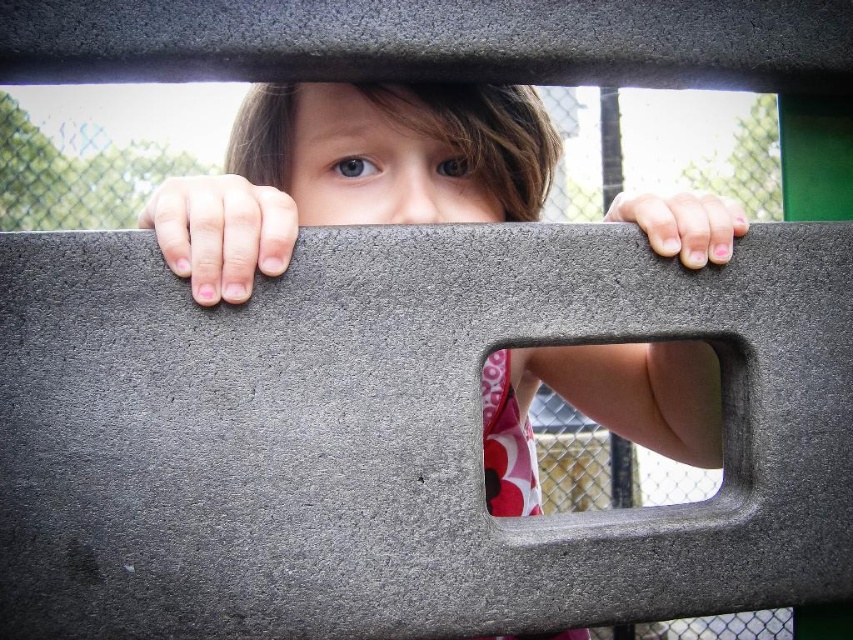
You are standing at the origin point of the playground structure. You need to locate the matte gray concrete at center. Which direction should you move to reach it?

To reach the matte gray concrete at center, you should move towards the coordinates specified at point (x=351, y=172) from your current position.

You are a parent trying to ensure your child is safe while playing. You notice the child is holding onto the pink fabric at center and the matte gray concrete at center. Which object is positioned higher relative to the other?

The matte gray concrete at center is above the pink fabric at center, so the matte gray concrete at center is positioned higher.